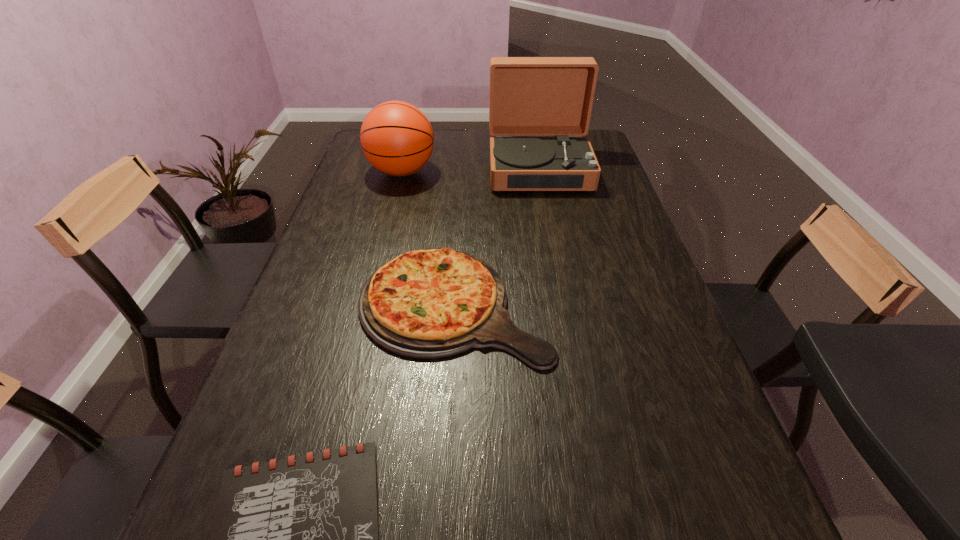
This screenshot has height=540, width=960. I want to click on pizza present at the left edge, so click(433, 303).

Find the location of `object positioned at the right edge`. object positioned at the right edge is located at coordinates (529, 96).

The image size is (960, 540). Find the location of `object that is positioned at the far left corner`. object that is positioned at the far left corner is located at coordinates (396, 137).

Locate an element on the screen. Image resolution: width=960 pixels, height=540 pixels. object located at the far right corner is located at coordinates (529, 96).

Where is `free space at the left edge`? Image resolution: width=960 pixels, height=540 pixels. free space at the left edge is located at coordinates (293, 345).

You are a GUI agent. You are given a task and a screenshot of the screen. Output one action in this format:
    pyautogui.click(x=<x>, y=<y>)
    Task: Click on the vacant region at the right edge of the desktop
    
    Given the screenshot: What is the action you would take?
    pyautogui.click(x=602, y=202)

Where is `blank region between the phonograph record and the pizza`? The image size is (960, 540). blank region between the phonograph record and the pizza is located at coordinates (496, 237).

Where is `vacant point located between the tallest object and the basketball`? This screenshot has width=960, height=540. vacant point located between the tallest object and the basketball is located at coordinates (470, 171).

Locate an element on the screen. This screenshot has height=540, width=960. free spot between the second nearest object and the second tallest object is located at coordinates (428, 238).

I want to click on the third closest object to the notebook, so 396,137.